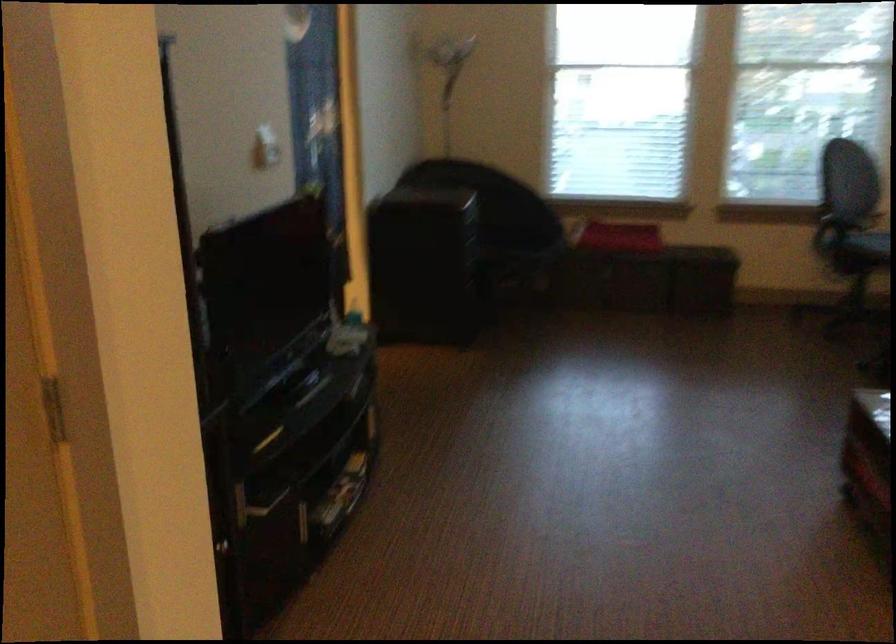
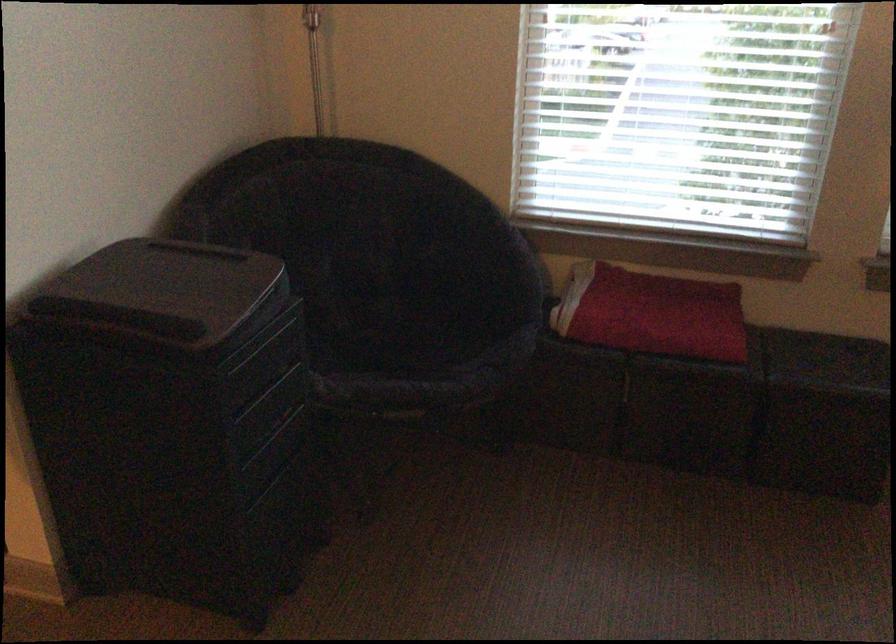
In the second image, find the point that corresponds to the point at 495,242 in the first image.

(393, 339)